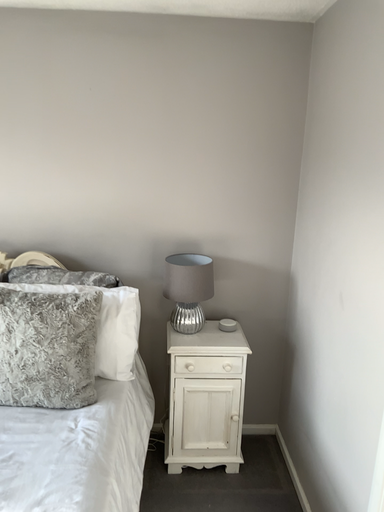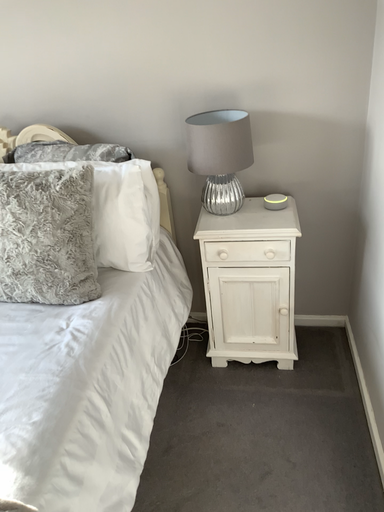
Question: How did the camera likely rotate when shooting the video?

Choices:
 (A) rotated left
 (B) rotated right

Answer: (A)